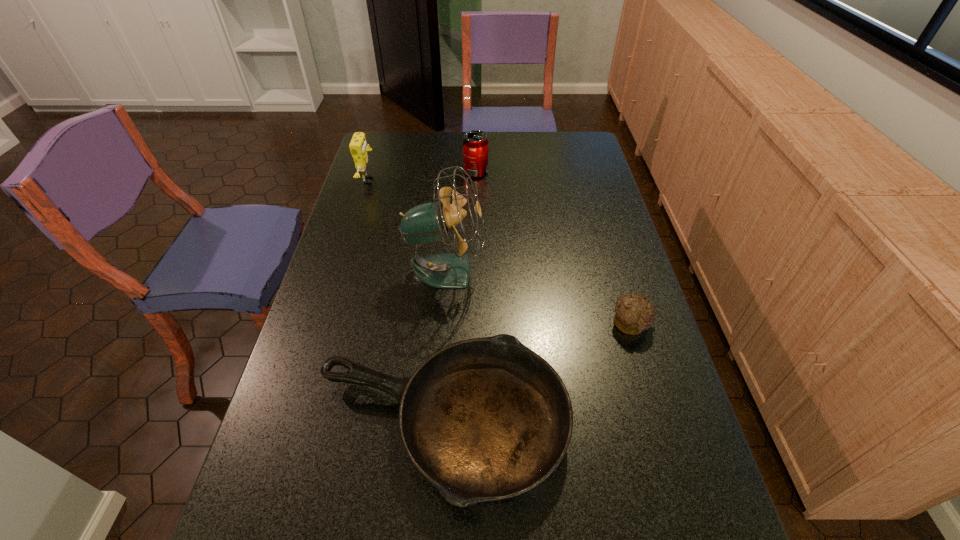
Locate an element on the screen. This screenshot has width=960, height=540. vacant point located between the soda can and the muffin is located at coordinates (554, 248).

I want to click on empty space that is in between the soda can and the nearest object, so click(459, 298).

Locate an element on the screen. This screenshot has height=540, width=960. vacant area that lies between the second nearest object and the leftmost object is located at coordinates (500, 252).

Image resolution: width=960 pixels, height=540 pixels. What are the coordinates of `vacant point located between the soda can and the second nearest object` in the screenshot? It's located at (554, 248).

Where is `free space between the soda can and the sponge`? This screenshot has height=540, width=960. free space between the soda can and the sponge is located at coordinates (x=422, y=176).

I want to click on vacant area between the frying pan and the fan, so click(x=444, y=347).

Identify which object is located as the fourth nearest to the tallest object. Please provide its 2D coordinates. Your answer should be formatted as a tuple, i.e. [(x, y)], where the tuple contains the x and y coordinates of a point satisfying the conditions above.

[(475, 145)]

Find the location of a particular element. The image size is (960, 540). object that is the second closest to the nearest object is located at coordinates (429, 222).

The image size is (960, 540). What are the coordinates of `free space in the image that satisfies the following two spatial constraints: 1. on the back side of the frying pan; 2. on the front-facing side of the fan for air flow` in the screenshot? It's located at (452, 271).

Locate an element on the screen. This screenshot has width=960, height=540. vacant area that satisfies the following two spatial constraints: 1. on the face of the nearest object; 2. on the left side of the sponge is located at coordinates (294, 423).